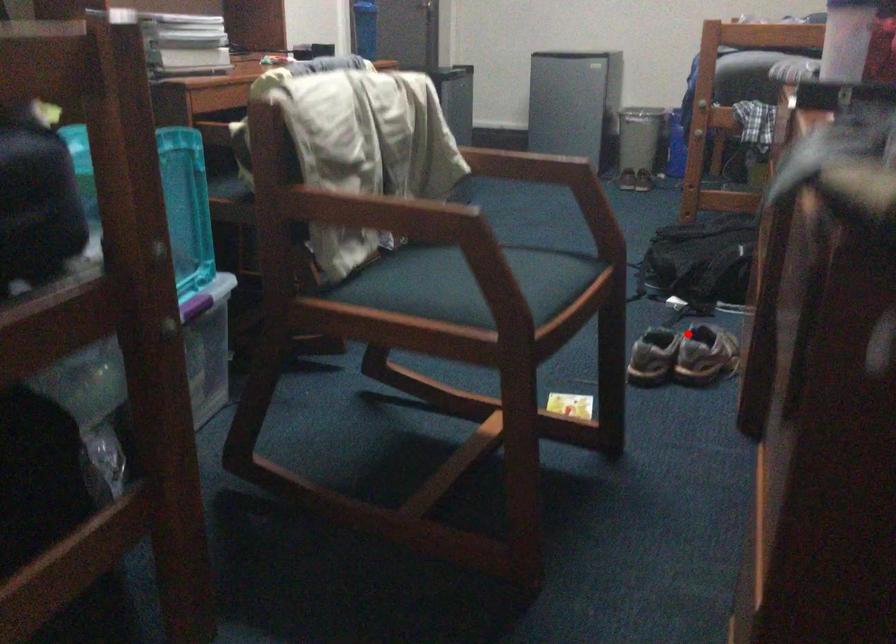
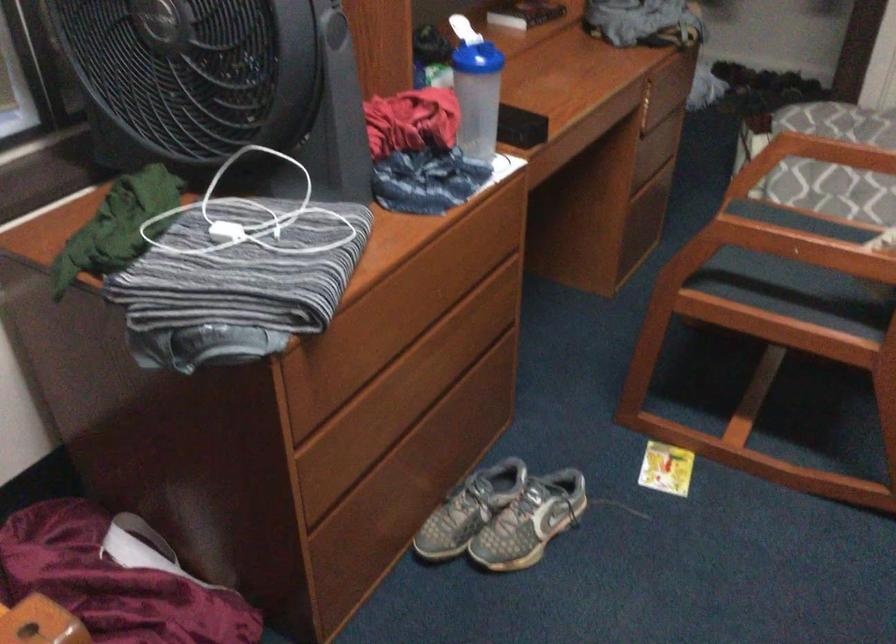
Question: A red point is marked in image1. In image2, is the corresponding 3D point closer to the camera or farther? Reply with the corresponding letter.

Choices:
 (A) The corresponding 3D point is closer.
 (B) The corresponding 3D point is farther.

Answer: (A)